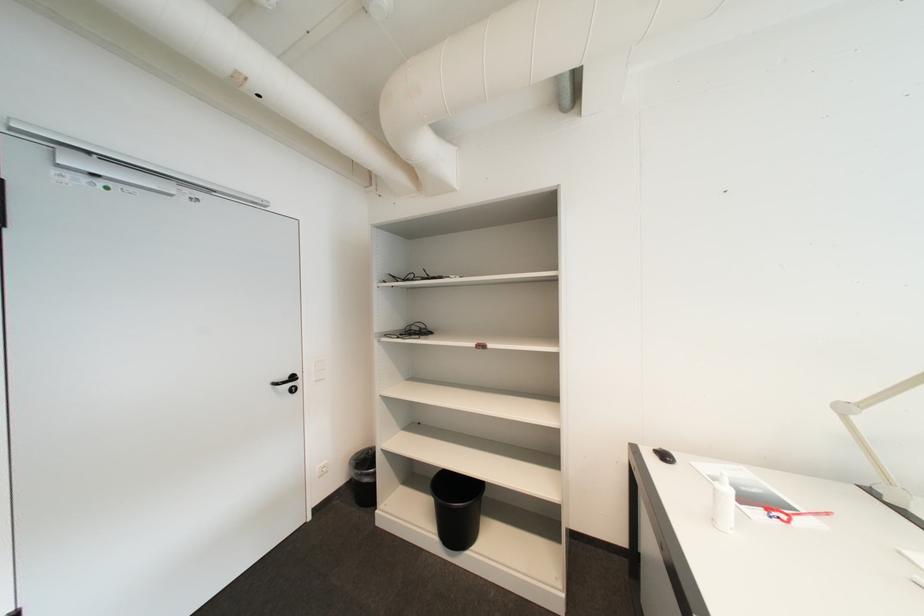
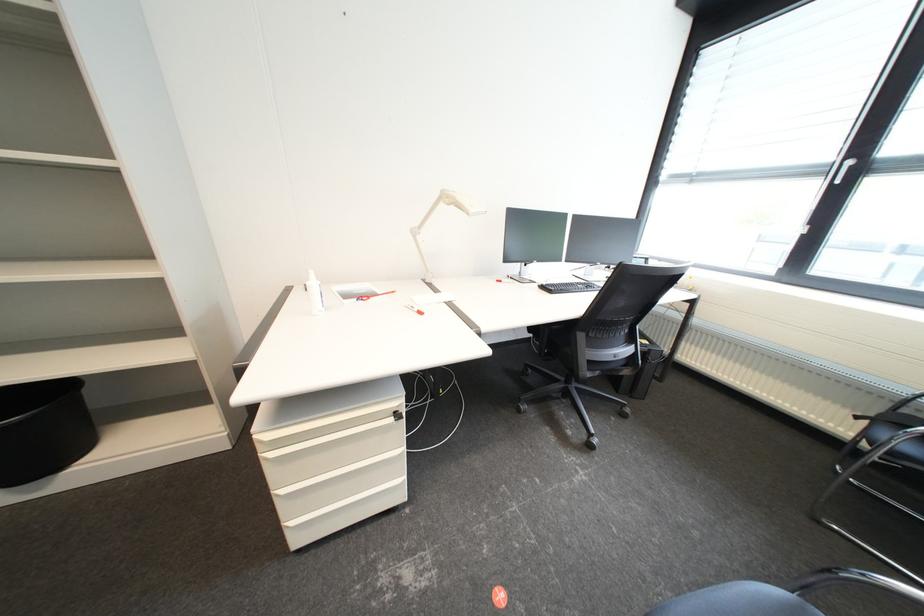
How did the camera likely rotate?

The camera rotated toward right-down.